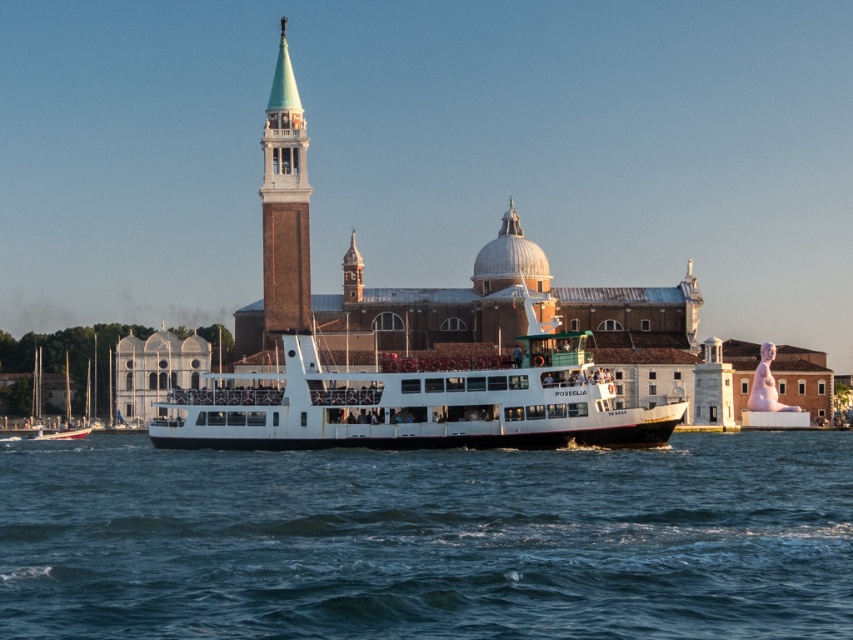
Question: Among these points, which one is nearest to the camera?

Choices:
 (A) (279, 276)
 (B) (84, 593)

Answer: (B)

Question: Can you confirm if blue water at center is positioned to the left of green brick tower at upper center?

Choices:
 (A) yes
 (B) no

Answer: (B)

Question: Can you confirm if blue water at center is positioned below green brick tower at upper center?

Choices:
 (A) yes
 (B) no

Answer: (A)

Question: In this image, where is blue water at center located relative to green brick tower at upper center?

Choices:
 (A) right
 (B) left

Answer: (A)

Question: Among these points, which one is nearest to the camera?

Choices:
 (A) [x=294, y=212]
 (B) [x=4, y=536]

Answer: (B)